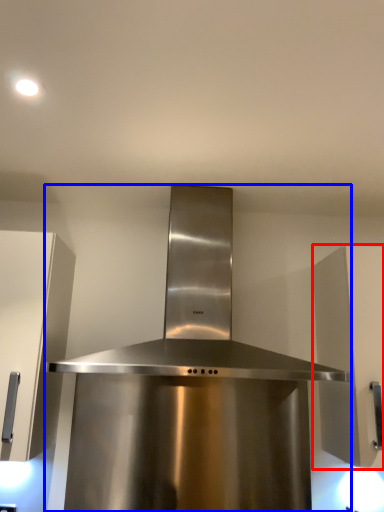
Question: Which point is closer to the camera, cabinetry (highlighted by a red box) or home appliance (highlighted by a blue box)?

Choices:
 (A) cabinetry
 (B) home appliance

Answer: (B)